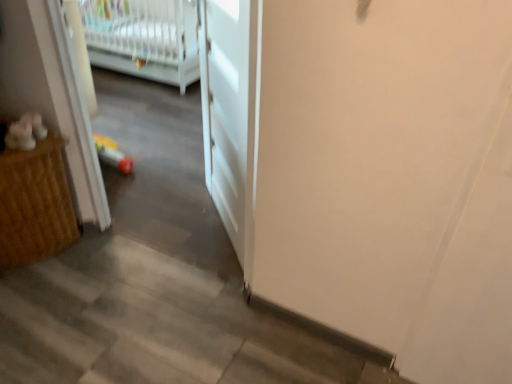
Question: Are wooden cabinet at left and white plastic infant bed at upper left making contact?

Choices:
 (A) no
 (B) yes

Answer: (A)

Question: From a real-world perspective, is wooden cabinet at left on white plastic infant bed at upper left?

Choices:
 (A) no
 (B) yes

Answer: (A)

Question: Is wooden cabinet at left completely or partially outside of white plastic infant bed at upper left?

Choices:
 (A) no
 (B) yes

Answer: (B)

Question: From a real-world perspective, is wooden cabinet at left physically below white plastic infant bed at upper left?

Choices:
 (A) no
 (B) yes

Answer: (B)

Question: Is wooden cabinet at left closer to camera compared to white plastic infant bed at upper left?

Choices:
 (A) no
 (B) yes

Answer: (B)

Question: From the image's perspective, is wooden cabinet at left over white plastic infant bed at upper left?

Choices:
 (A) no
 (B) yes

Answer: (A)

Question: Does wooden cabinet at left have a larger size compared to white matte door at center?

Choices:
 (A) yes
 (B) no

Answer: (A)

Question: Is wooden cabinet at left facing away from white matte door at center?

Choices:
 (A) yes
 (B) no

Answer: (B)

Question: Is wooden cabinet at left not near white matte door at center?

Choices:
 (A) yes
 (B) no

Answer: (B)

Question: Is wooden cabinet at left wider than white matte door at center?

Choices:
 (A) no
 (B) yes

Answer: (B)

Question: Does wooden cabinet at left have a lesser height compared to white matte door at center?

Choices:
 (A) yes
 (B) no

Answer: (A)

Question: Does wooden cabinet at left have a greater height compared to white matte door at center?

Choices:
 (A) yes
 (B) no

Answer: (B)

Question: Considering the relative sizes of white matte door at center and wooden cabinet at left in the image provided, is white matte door at center smaller than wooden cabinet at left?

Choices:
 (A) no
 (B) yes

Answer: (B)